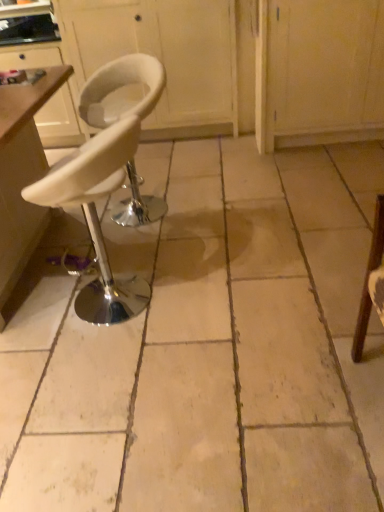
What are the coordinates of `empty space that is to the right of white matte stool at left, the second chair in the back-to-front sequence` in the screenshot? It's located at (210, 290).